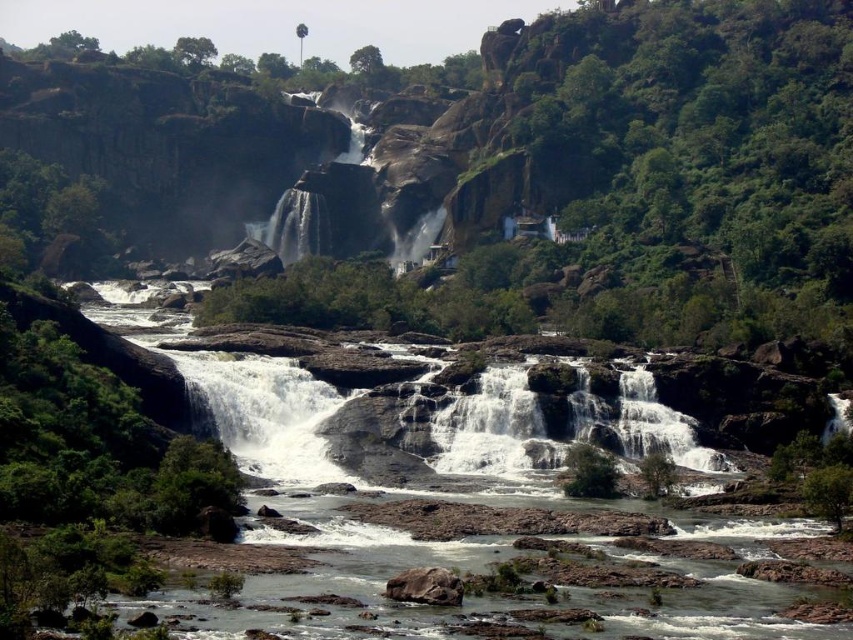
You are standing at the edge of the brown rock river at center and want to see the white smooth waterfalls at center. Which direction should you move to get a better view?

Since the brown rock river at center is in front of the white smooth waterfalls at center, you should move backward to get a better view of the waterfalls.

You are a hiker standing at the edge of the brown rock river at center. You want to cross to the other side. Can you step onto the white smooth waterfalls at center to do so?

The brown rock river at center is positioned over the white smooth waterfalls at center, meaning the waterfalls are underneath the river. Since the waterfalls are flowing beneath, you cannot step onto them to cross safely. You should look for a solid rock path instead.